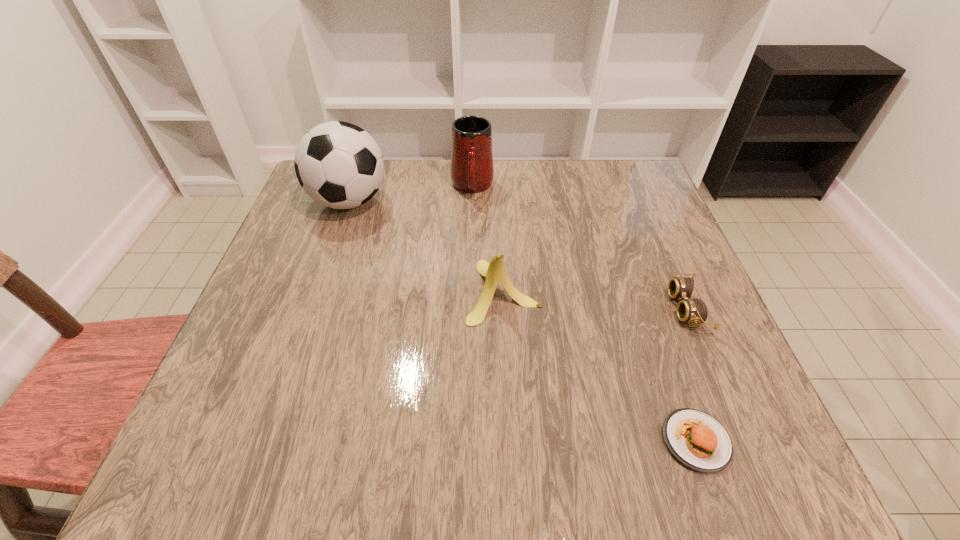
Where is `object that is positioned at the far left corner`? Image resolution: width=960 pixels, height=540 pixels. object that is positioned at the far left corner is located at coordinates (338, 164).

Image resolution: width=960 pixels, height=540 pixels. What are the coordinates of `object positioned at the near right corner` in the screenshot? It's located at (696, 439).

This screenshot has width=960, height=540. In order to click on blank space at the far edge in this screenshot , I will do `click(456, 191)`.

At what (x,y) coordinates should I click in order to perform the action: click on free space at the near edge of the desktop. Please return your answer as a coordinate pair (x, y). Looking at the image, I should click on (351, 436).

In the image, there is a desktop. Where is `blank space at the left edge`? This screenshot has width=960, height=540. blank space at the left edge is located at coordinates (297, 222).

The image size is (960, 540). I want to click on vacant space at the right edge of the desktop, so click(x=626, y=239).

In the image, there is a desktop. Where is `vacant space at the near left corner`? The width and height of the screenshot is (960, 540). vacant space at the near left corner is located at coordinates (283, 443).

The width and height of the screenshot is (960, 540). What are the coordinates of `vacant region at the far right corner of the desktop` in the screenshot? It's located at point(611,206).

Locate an element on the screen. Image resolution: width=960 pixels, height=540 pixels. vacant space that is in between the third tallest object and the soccer ball is located at coordinates (426, 246).

I want to click on free spot between the fourth tallest object and the nearest object, so click(691, 375).